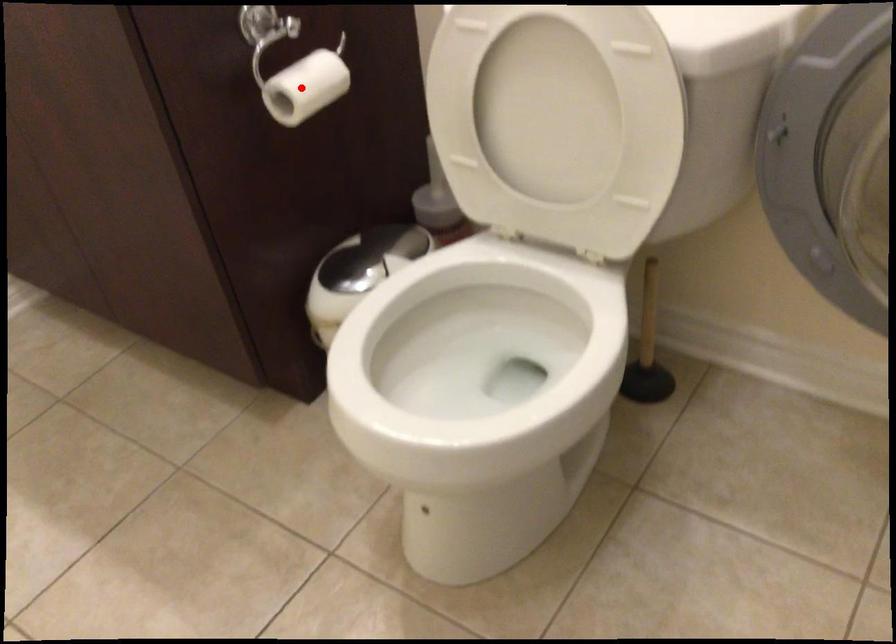
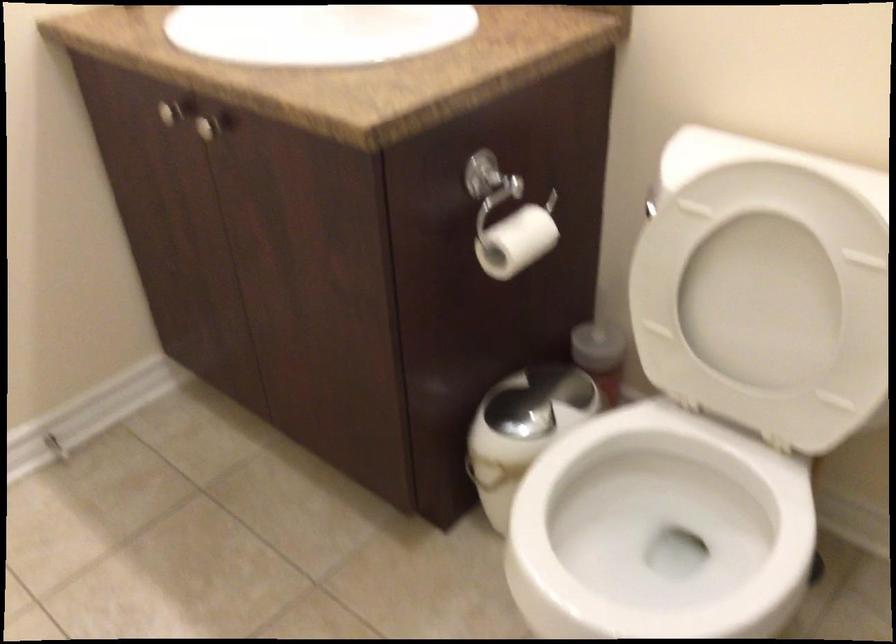
In the second image, find the point that corresponds to the highlighted location in the first image.

(515, 242)